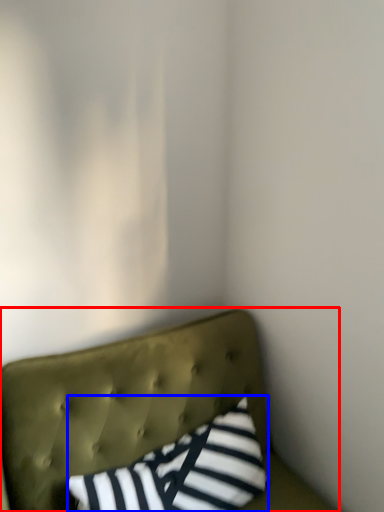
Question: Which object is closer to the camera taking this photo, furniture (highlighted by a red box) or pillow (highlighted by a blue box)?

Choices:
 (A) furniture
 (B) pillow

Answer: (A)